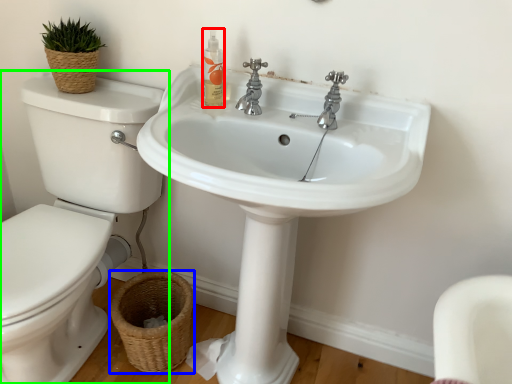
Question: Which object is the closest to the cleaning product (highlighted by a red box)? Choose among these: basket (highlighted by a blue box) or toilet (highlighted by a green box).

Choices:
 (A) basket
 (B) toilet

Answer: (B)